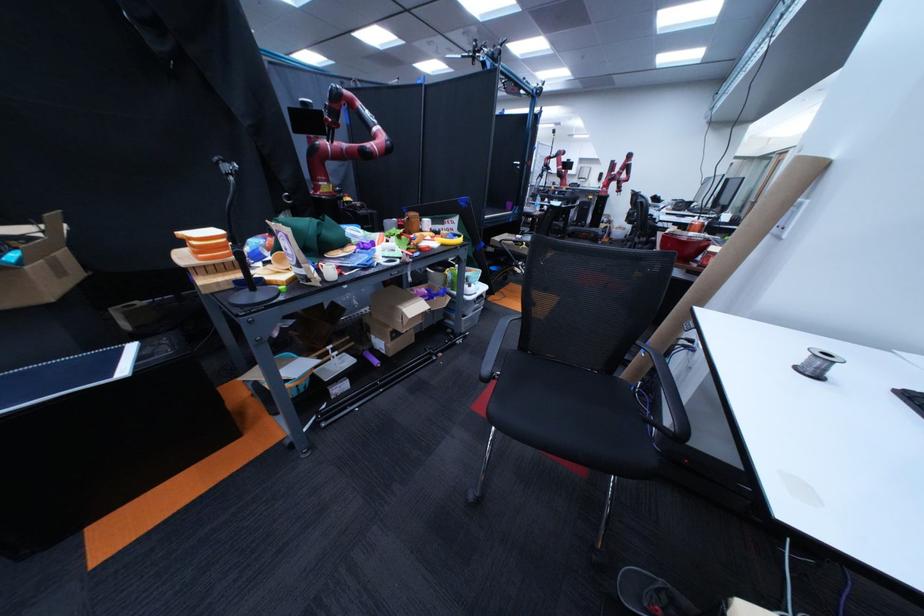
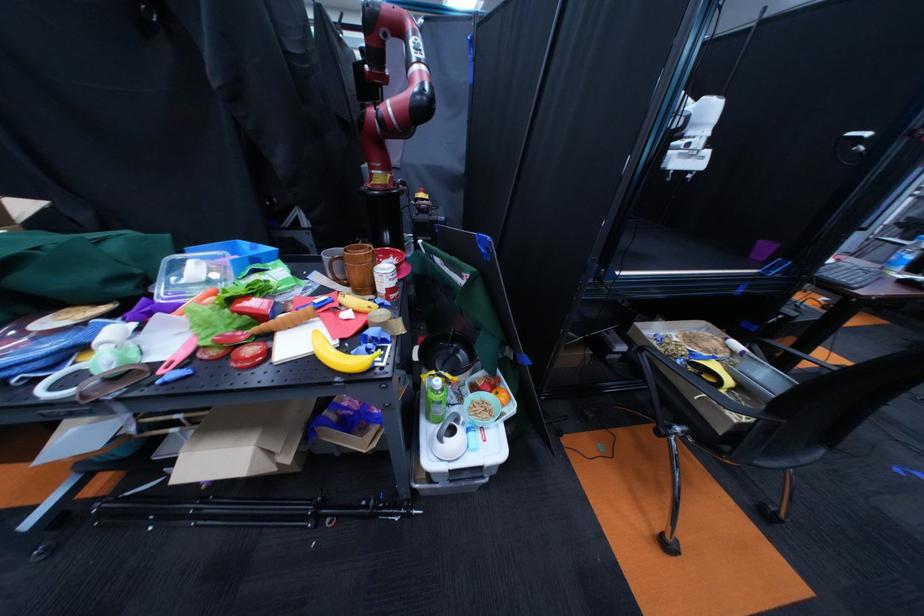
In the second image, find the point that corresponds to the point at 558,291 in the first image.

(776, 517)